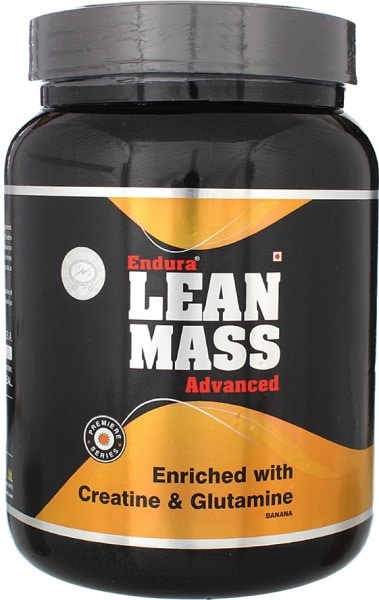
Find the location of a particular element. Image resolution: width=379 pixels, height=600 pixels. black jar is located at coordinates (289, 184), (203, 559).